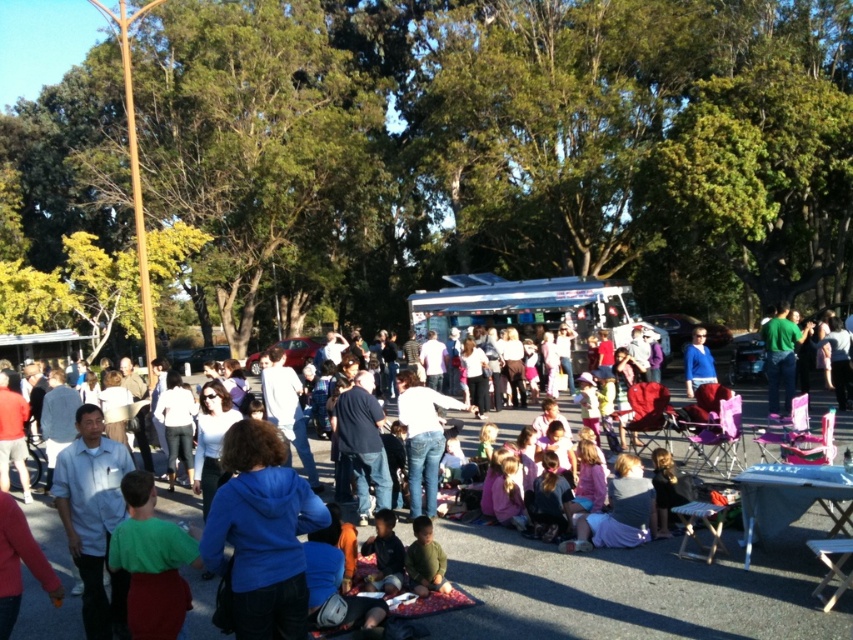
Who is positioned more to the right, blue fleece jacket at lower center or blue fleece jacket at center?

Positioned to the right is blue fleece jacket at lower center.

Does point (556, 614) come farther from viewer compared to point (252, 524)?

Yes, it is behind point (252, 524).

Identify the location of blue fleece jacket at lower center. (635, 589).

Between blue fleece jacket at center and jeans at center, which one is positioned higher?

blue fleece jacket at center is higher up.

Which is more to the right, blue fleece jacket at center or jeans at center?

jeans at center is more to the right.

The image size is (853, 640). What are the coordinates of `blue fleece jacket at center` in the screenshot? It's located at (260, 532).

This screenshot has width=853, height=640. I want to click on blue fleece jacket at center, so click(x=260, y=532).

Can you confirm if blue fleece jacket at lower center is wider than jeans at center?

Yes.

Who is positioned more to the right, blue fleece jacket at lower center or jeans at center?

From the viewer's perspective, blue fleece jacket at lower center appears more on the right side.

Which is behind, point (741, 566) or point (409, 396)?

Point (409, 396)

At what (x,y) coordinates should I click in order to perform the action: click on blue fleece jacket at lower center. Please return your answer as a coordinate pair (x, y). This screenshot has width=853, height=640. Looking at the image, I should click on click(x=635, y=589).